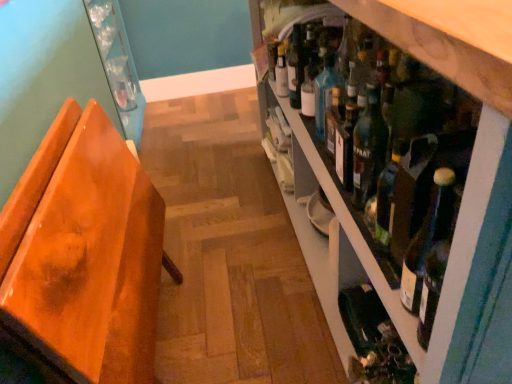
Question: Does green glass bottles at right appear on the right side of teal glass bottle at shelf center?

Choices:
 (A) yes
 (B) no

Answer: (A)

Question: Is green glass bottles at right located outside teal glass bottle at shelf center?

Choices:
 (A) yes
 (B) no

Answer: (A)

Question: Can you confirm if green glass bottles at right is taller than teal glass bottle at shelf center?

Choices:
 (A) no
 (B) yes

Answer: (B)

Question: Is green glass bottles at right behind teal glass bottle at shelf center?

Choices:
 (A) no
 (B) yes

Answer: (A)

Question: Is green glass bottles at right next to teal glass bottle at shelf center and touching it?

Choices:
 (A) no
 (B) yes

Answer: (A)

Question: Does green glass bottles at right have a lesser width compared to teal glass bottle at shelf center?

Choices:
 (A) yes
 (B) no

Answer: (B)

Question: Is orange wood chair at left facing towards white glass bottle at upper center?

Choices:
 (A) no
 (B) yes

Answer: (B)

Question: From the image's perspective, is orange wood chair at left below white glass bottle at upper center?

Choices:
 (A) yes
 (B) no

Answer: (A)

Question: Is orange wood chair at left to the right of white glass bottle at upper center from the viewer's perspective?

Choices:
 (A) yes
 (B) no

Answer: (B)

Question: Considering the relative sizes of orange wood chair at left and white glass bottle at upper center in the image provided, is orange wood chair at left shorter than white glass bottle at upper center?

Choices:
 (A) no
 (B) yes

Answer: (A)

Question: Is the position of orange wood chair at left less distant than that of white glass bottle at upper center?

Choices:
 (A) no
 (B) yes

Answer: (B)

Question: Is orange wood chair at left behind white glass bottle at upper center?

Choices:
 (A) yes
 (B) no

Answer: (B)

Question: Does orange wood chair at left have a lesser height compared to green glass bottle at lower right?

Choices:
 (A) no
 (B) yes

Answer: (A)